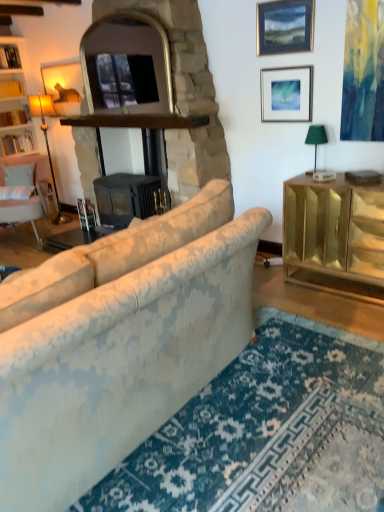
Question: Which is correct: gold mirrored cabinet at right is inside matte gold floor lamp at left, arranged as the 2th lamp when viewed from the front, or outside of it?

Choices:
 (A) inside
 (B) outside

Answer: (B)

Question: From a real-world perspective, is gold mirrored cabinet at right positioned above or below matte gold floor lamp at left, arranged as the 2th lamp when viewed from the front?

Choices:
 (A) below
 (B) above

Answer: (A)

Question: Considering the real-world distances, which object is closest to the black matte fireplace at center, which appears as the first fireplace when viewed from the right?

Choices:
 (A) matte black picture frame at upper center, which is counted as the first picture frame, starting from the top
 (B) green fabric lampshade at right, the 1th lamp viewed from the front
 (C) white wood bookshelf at left
 (D) floral fabric sofa at center
 (E) light pink fabric chair at left

Answer: (A)

Question: Which is farther from the matte gold floor lamp at left, placed as the first lamp when sorted from back to front?

Choices:
 (A) silver metallic picture frame at upper right, positioned as the 2th picture frame in top-to-bottom order
 (B) matte black picture frame at upper center, which is counted as the first picture frame, starting from the top
 (C) stone fireplace at center, acting as the 2th fireplace starting from the right
 (D) gold mirrored cabinet at right
 (E) light pink fabric chair at left

Answer: (D)